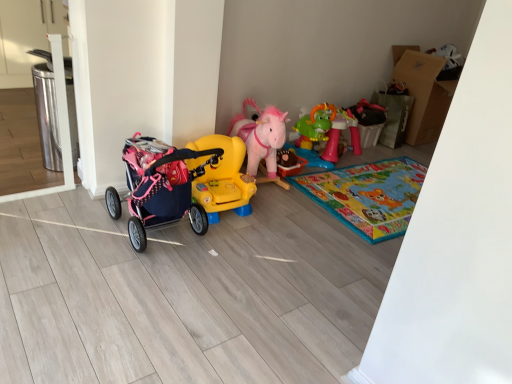
Question: Is pink plush horse at center, placed as the third toy when sorted from left to right, inside or outside of rubberized green dinosaur table at center-right, acting as the first toy starting from the right?

Choices:
 (A) outside
 (B) inside

Answer: (A)

Question: Considering the positions of pink plush horse at center, marked as the 2th toy in a right-to-left arrangement, and rubberized green dinosaur table at center-right, acting as the first toy starting from the right, in the image, is pink plush horse at center, marked as the 2th toy in a right-to-left arrangement, taller or shorter than rubberized green dinosaur table at center-right, acting as the first toy starting from the right,?

Choices:
 (A) short
 (B) tall

Answer: (B)

Question: Considering the real-world distances, which object is closest to the rubberized green dinosaur table at center-right, which ranks as the 4th toy in left-to-right order?

Choices:
 (A) yellow plastic ride-on car at center, which is the third toy in right-to-left order
 (B) pink fabric stroller at left, which is counted as the 4th toy, starting from the right
 (C) pink plush horse at center, placed as the third toy when sorted from left to right

Answer: (C)

Question: Which is farther from the pink fabric stroller at left, the 1th toy when ordered from left to right?

Choices:
 (A) rubberized green dinosaur table at center-right, acting as the first toy starting from the right
 (B) yellow plastic ride-on car at center, which is the third toy in right-to-left order
 (C) pink plush horse at center, placed as the third toy when sorted from left to right

Answer: (A)